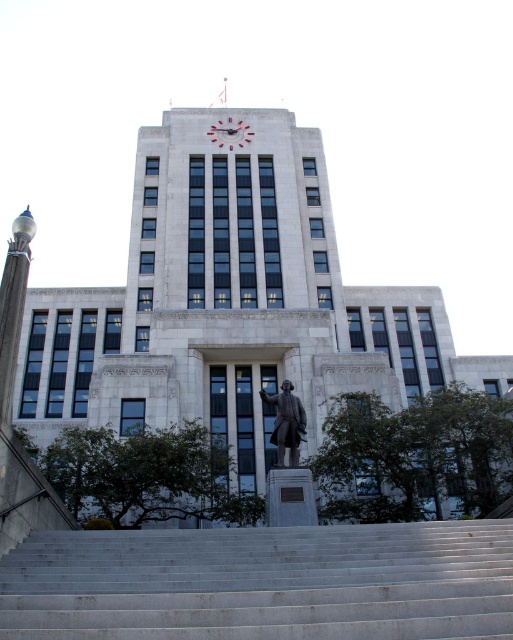
You are standing at the entrance of the grand building and want to reach the statue of a man dressed in formal attire located in front of the building. The statue is positioned at the lower center. There is a point marked at coordinates point (263, 582). What is located at this point that you might need to use to approach the statue?

At point (263, 582) lies white marble stairs at lower center, which you can use to approach the statue.

You are standing in front of the building and want to take a photo of both the white marble stairs at lower center and the bronze statue at center. Which object should you focus on first if you want to include both in the frame without moving the camera?

You should focus on the bronze statue at center first because it is taller than the white marble stairs at lower center, so adjusting the frame to include its height will naturally include the stairs as well.

You are standing in front of the building and want to take a photo that includes both the statue and the clock. The statue is located at point (65, 589) and the clock is at point (278, 440). Which object is closer to you so that you can focus on it first?

Point (65, 589) is closer to the camera than point (278, 440), so the statue at point (65, 589) is closer to you and should be focused on first.